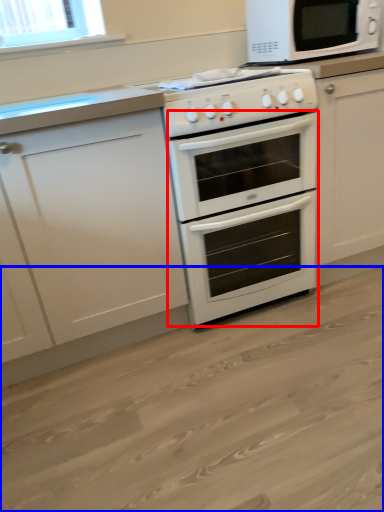
Question: Among these objects, which one is farthest to the camera, oven (highlighted by a red box) or plain (highlighted by a blue box)?

Choices:
 (A) oven
 (B) plain

Answer: (A)